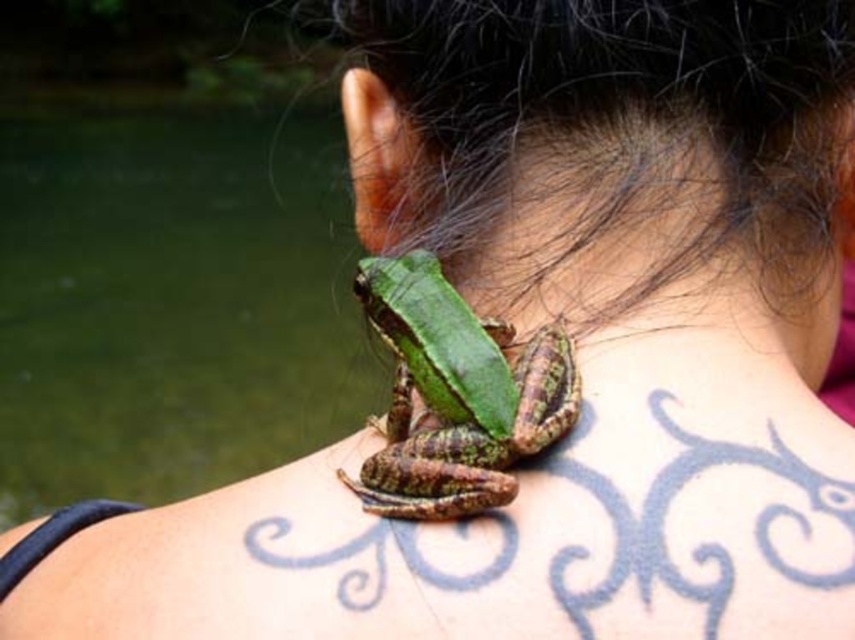
Does green matte skin at center appear over green rough skin frog at center?

Correct, green matte skin at center is located above green rough skin frog at center.

Does point (761, 252) come in front of point (523, 371)?

No, (761, 252) is further to viewer.

Which is behind, point (702, 262) or point (537, 404)?

The point (702, 262) is more distant.

Locate an element on the screen. This screenshot has width=855, height=640. green matte skin at center is located at coordinates (659, 234).